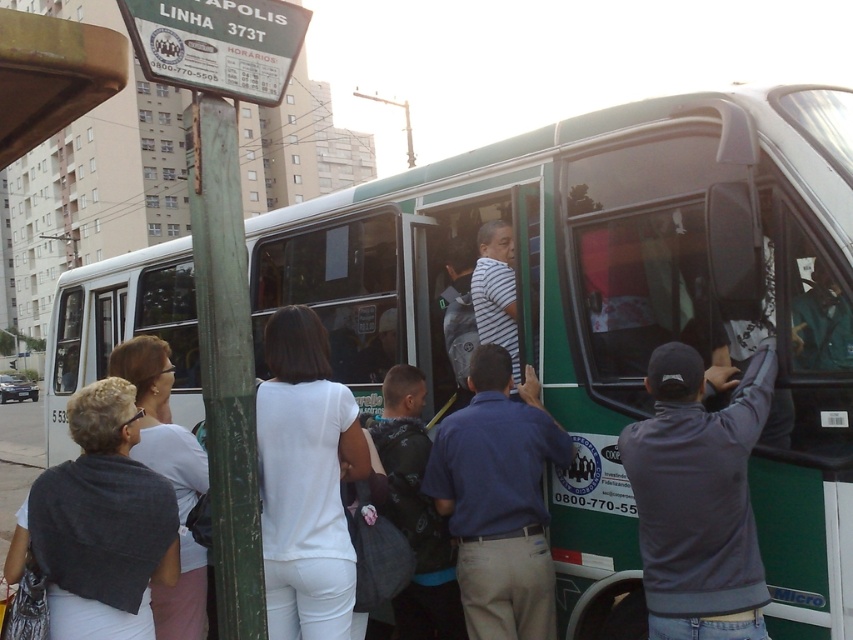
Question: Considering the relative positions of white matte shirt at center and blue shirt at center in the image provided, where is white matte shirt at center located with respect to blue shirt at center?

Choices:
 (A) above
 (B) below

Answer: (A)

Question: From the image, what is the correct spatial relationship of white matte shirt at center in relation to white fabric shirt at left?

Choices:
 (A) below
 (B) above

Answer: (B)

Question: Which point appears closest to the camera in this image?

Choices:
 (A) (732, 444)
 (B) (474, 545)
 (C) (184, 513)

Answer: (A)

Question: Which point is farther from the camera taking this photo?

Choices:
 (A) (547, 420)
 (B) (729, 484)
 (C) (132, 600)
 (D) (146, 420)

Answer: (A)

Question: Can you confirm if white matte shirt at center is wider than white fabric shirt at left?

Choices:
 (A) yes
 (B) no

Answer: (B)

Question: Which object is the closest to the white fabric shawl at lower left?

Choices:
 (A) white matte shirt at center
 (B) white fabric shirt at left

Answer: (B)